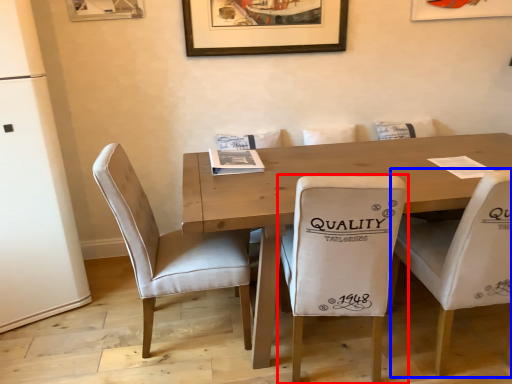
Question: Which object appears farthest to the camera in this image, chair (highlighted by a red box) or chair (highlighted by a blue box)?

Choices:
 (A) chair
 (B) chair

Answer: (B)